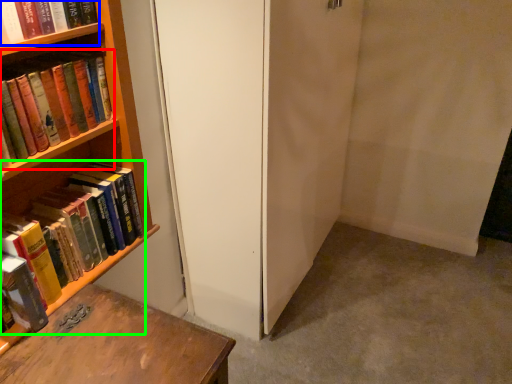
Question: Based on their relative distances, which object is nearer to book (highlighted by a red box)? Choose from book (highlighted by a blue box) and book (highlighted by a green box).

Choices:
 (A) book
 (B) book

Answer: (A)